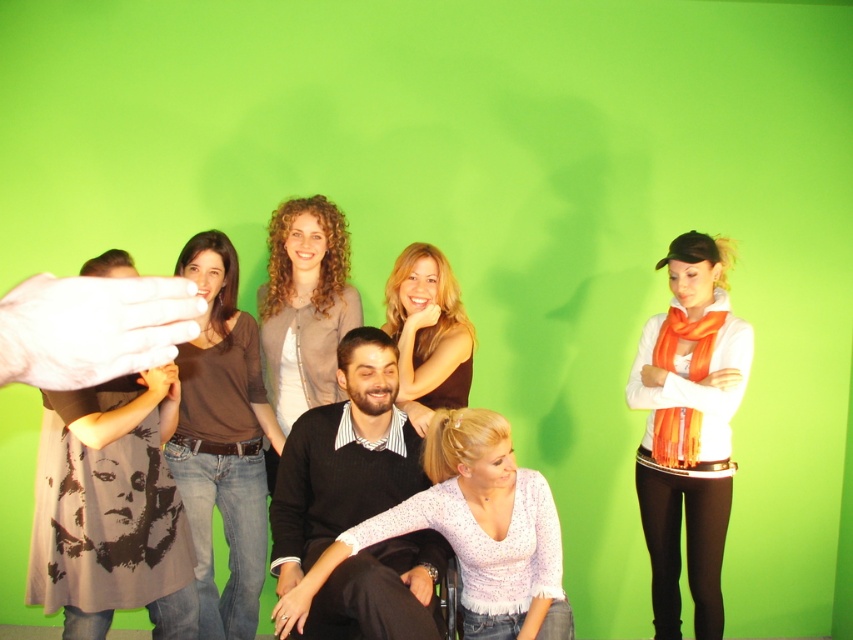
Question: Does matte black sweater at center have a lesser width compared to black sweater at center?

Choices:
 (A) no
 (B) yes

Answer: (B)

Question: Which object is the closest to the white textured blouse at center?

Choices:
 (A) matte brown shirt at center
 (B) black sweater at center
 (C) matte brown blouse at center

Answer: (B)

Question: Can you confirm if matte black sweater at center is positioned above orange scarf at center?

Choices:
 (A) yes
 (B) no

Answer: (B)

Question: Which point is closer to the camera?

Choices:
 (A) matte brown shirt at center
 (B) curly hair woman at center
 (C) orange scarf at center
 (D) matte black sweater at center

Answer: (D)

Question: Based on their relative distances, which object is nearer to the black sweater at center?

Choices:
 (A) matte black sweater at center
 (B) matte brown blouse at center
 (C) matte brown shirt at center
 (D) curly hair woman at center

Answer: (B)

Question: Is white textured blouse at center bigger than curly hair woman at center?

Choices:
 (A) no
 (B) yes

Answer: (B)